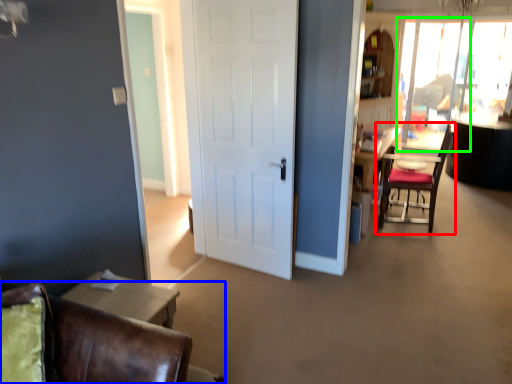
Question: Considering the real-world distances, which object is closest to chair (highlighted by a red box)? chair (highlighted by a blue box) or window screen (highlighted by a green box).

Choices:
 (A) chair
 (B) window screen

Answer: (B)